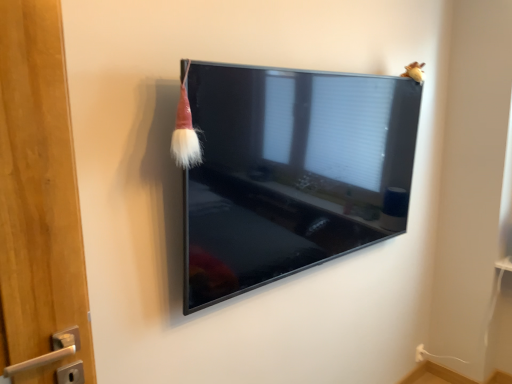
Question: From a real-world perspective, is red velvet brush at upper left physically located above or below fuzzy yellow toy at upper right?

Choices:
 (A) below
 (B) above

Answer: (A)

Question: Relative to fuzzy yellow toy at upper right, is red velvet brush at upper left in front or behind?

Choices:
 (A) front
 (B) behind

Answer: (A)

Question: Which object is the closest to the white plastic electric outlet at lower right?

Choices:
 (A) matte black tv at center
 (B) red velvet brush at upper left
 (C) fuzzy yellow toy at upper right

Answer: (C)

Question: Which object is the farthest from the white plastic electric outlet at lower right?

Choices:
 (A) red velvet brush at upper left
 (B) fuzzy yellow toy at upper right
 (C) matte black tv at center

Answer: (A)